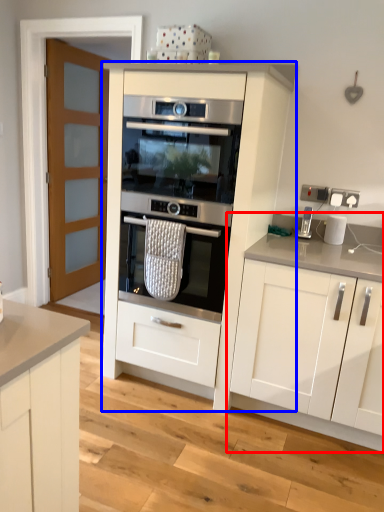
Question: Which object is closer to the camera taking this photo, cabinetry (highlighted by a red box) or cabinetry (highlighted by a blue box)?

Choices:
 (A) cabinetry
 (B) cabinetry

Answer: (A)